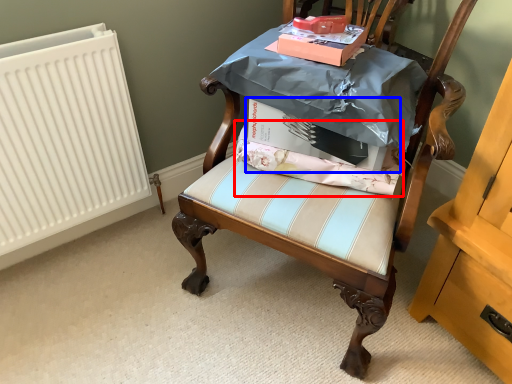
Question: Which object is further to the camera taking this photo, fabric (highlighted by a red box) or cardboard box (highlighted by a blue box)?

Choices:
 (A) fabric
 (B) cardboard box

Answer: (A)